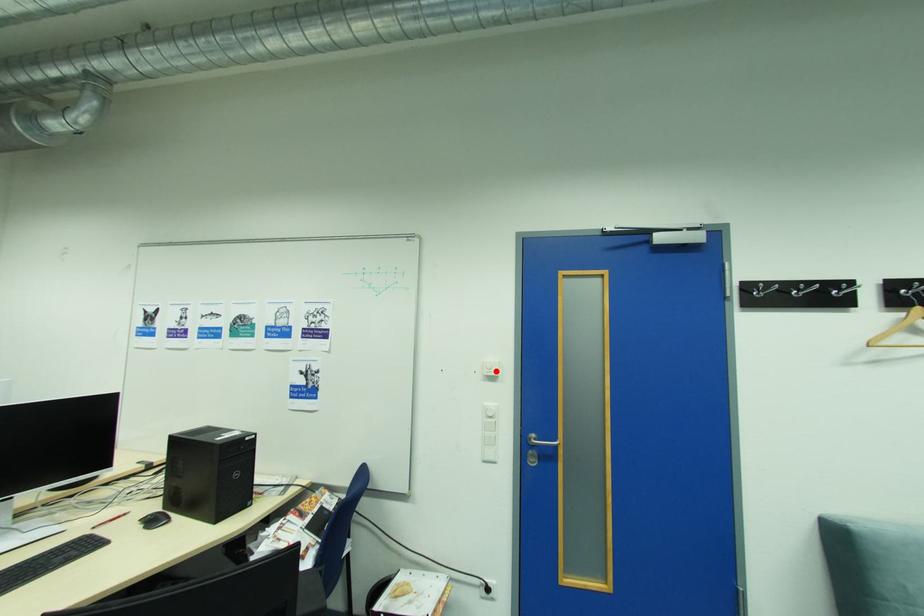
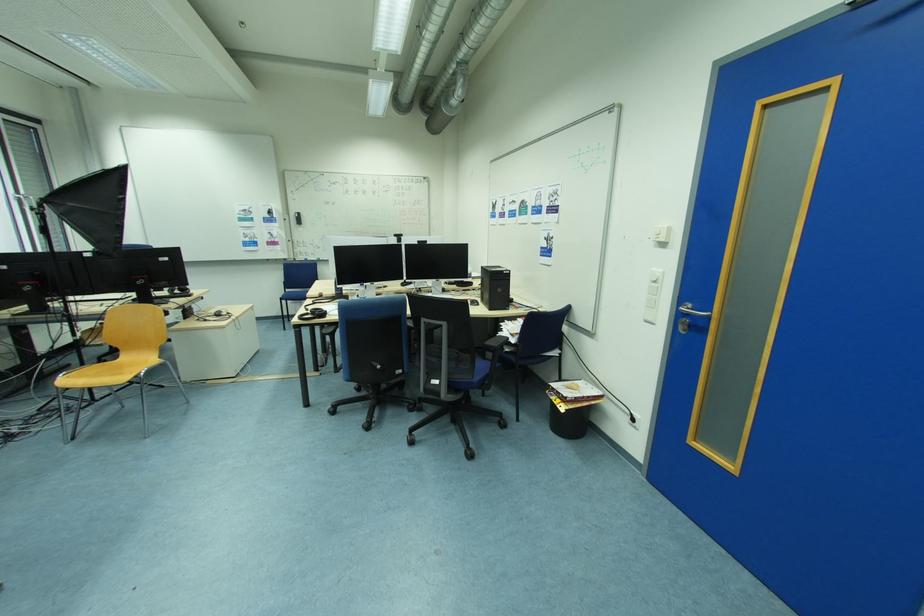
Question: I am providing you with two images of the same scene from different viewpoints. A red point is marked on the first image. At the location where the point appears in image 1, is it still visible in image 2?

Choices:
 (A) Yes
 (B) No

Answer: (A)